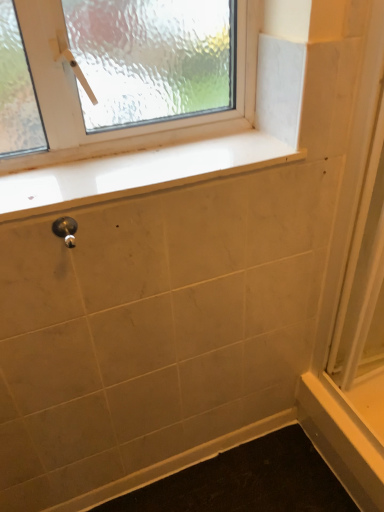
In order to face polished silver door handle at lower left, should I rotate leftwards or rightwards?

A 16.441 degree turn to the left will do.

You are a GUI agent. You are given a task and a screenshot of the screen. Output one action in this format:
    pyautogui.click(x=<x>, y=<y>)
    Task: Click on the polished silver door handle at lower left
    This screenshot has width=384, height=512.
    Given the screenshot: What is the action you would take?
    pyautogui.click(x=65, y=230)

Can you confirm if white glossy window sill at upper center is positioned to the left of white glossy screen door at right?

Yes.

From a real-world perspective, between white glossy window sill at upper center and white glossy screen door at right, who is vertically lower?

white glossy screen door at right is physically lower.

Is the depth of white glossy window sill at upper center greater than that of white glossy screen door at right?

That is True.

Considering the positions of objects white glossy screen door at right and white glossy window sill at upper center in the image provided, who is more to the right, white glossy screen door at right or white glossy window sill at upper center?

white glossy screen door at right is more to the right.

How different are the orientations of white glossy screen door at right and white glossy window sill at upper center in degrees?

89.8 degrees separate the facing orientations of white glossy screen door at right and white glossy window sill at upper center.

Is white glossy screen door at right facing away from white glossy window sill at upper center?

No, white glossy screen door at right is not facing away from white glossy window sill at upper center.

From the image's perspective, is white glossy screen door at right positioned above or below white glossy window sill at upper center?

Based on their image positions, white glossy screen door at right is located beneath white glossy window sill at upper center.

Is polished silver door handle at lower left positioned with its back to white glossy screen door at right?

That's not correct — polished silver door handle at lower left is not looking away from white glossy screen door at right.

Are polished silver door handle at lower left and white glossy screen door at right far apart?

No, there isn't a large distance between polished silver door handle at lower left and white glossy screen door at right.

Is polished silver door handle at lower left taller than white glossy screen door at right?

Incorrect, the height of polished silver door handle at lower left is not larger of that of white glossy screen door at right.

In terms of size, does polished silver door handle at lower left appear bigger or smaller than white glossy screen door at right?

In the image, polished silver door handle at lower left appears to be smaller than white glossy screen door at right.

Is white glossy screen door at right positioned with its back to polished silver door handle at lower left?

No.

Which object is thinner, white glossy screen door at right or polished silver door handle at lower left?

With smaller width is white glossy screen door at right.

Consider the image. Is white glossy screen door at right inside the boundaries of polished silver door handle at lower left, or outside?

white glossy screen door at right is outside polished silver door handle at lower left.

Is white glossy screen door at right bigger than polished silver door handle at lower left?

Yes.

From the image's perspective, who appears lower, white glossy window sill at upper center or polished silver door handle at lower left?

polished silver door handle at lower left appears lower in the image.

Between white glossy window sill at upper center and polished silver door handle at lower left, which one has less height?

With less height is white glossy window sill at upper center.

Can you tell me how much white glossy window sill at upper center and polished silver door handle at lower left differ in facing direction?

The facing directions of white glossy window sill at upper center and polished silver door handle at lower left are 1.27 degrees apart.

Is white glossy window sill at upper center positioned far away from polished silver door handle at lower left?

white glossy window sill at upper center is near polished silver door handle at lower left, not far away.

Based on their positions, is polished silver door handle at lower left located to the left or right of white glossy window sill at upper center?

Based on their positions, polished silver door handle at lower left is located to the left of white glossy window sill at upper center.

Considering the sizes of polished silver door handle at lower left and white glossy window sill at upper center in the image, is polished silver door handle at lower left taller or shorter than white glossy window sill at upper center?

Clearly, polished silver door handle at lower left is taller compared to white glossy window sill at upper center.

From the image's perspective, which object appears higher, polished silver door handle at lower left or white glossy window sill at upper center?

From the image's view, white glossy window sill at upper center is above.

Does point (59, 230) appear closer or farther from the camera than point (263, 140)?

Clearly, point (59, 230) is closer to the camera than point (263, 140).

What are the coordinates of `screen door below the white glossy window sill at upper center (from a real-world perspective)` in the screenshot? It's located at (354, 303).

Where is `screen door on the right of white glossy window sill at upper center`? The width and height of the screenshot is (384, 512). screen door on the right of white glossy window sill at upper center is located at coordinates (354, 303).

Based on their spatial positions, is polished silver door handle at lower left or white glossy screen door at right closer to white glossy window sill at upper center?

polished silver door handle at lower left is closer to white glossy window sill at upper center.

When comparing their distances from polished silver door handle at lower left, does white glossy window sill at upper center or white glossy screen door at right seem further?

The object further to polished silver door handle at lower left is white glossy screen door at right.

From the image, which object appears to be nearer to white glossy window sill at upper center, white glossy screen door at right or polished silver door handle at lower left?

Among the two, polished silver door handle at lower left is located nearer to white glossy window sill at upper center.

Which object lies further to the anchor point polished silver door handle at lower left, white glossy screen door at right or white glossy window sill at upper center?

white glossy screen door at right lies further to polished silver door handle at lower left than the other object.

Considering their positions, is white glossy window sill at upper center positioned further to white glossy screen door at right than polished silver door handle at lower left?

polished silver door handle at lower left.

Consider the image. From the image, which object appears to be nearer to white glossy screen door at right, polished silver door handle at lower left or white glossy window sill at upper center?

white glossy window sill at upper center is positioned closer to the anchor white glossy screen door at right.

Locate an element on the screen. This screenshot has height=512, width=384. window sill situated between polished silver door handle at lower left and white glossy screen door at right from left to right is located at coordinates (138, 173).